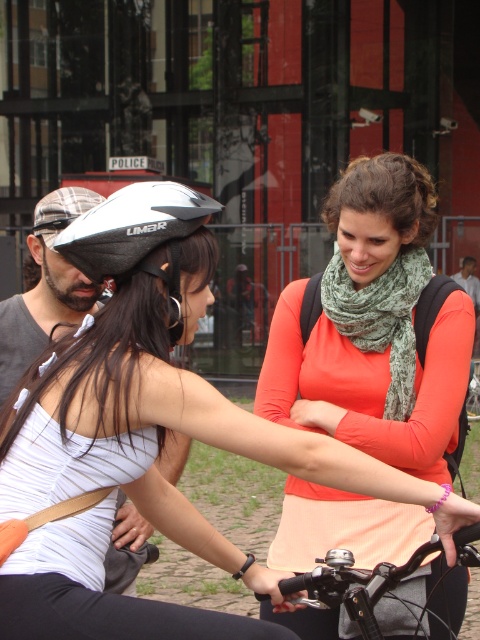
You are a photographer trying to capture a candid shot of the two women interacting. You want to ensure that both the dark gray fabric shirt at center and the metallic silver bicycle at center are visible in your frame. Based on their positions, which object should you position closer to the left side of your camera viewfinder to include both subjects effectively?

Since the dark gray fabric shirt at center is to the right of the metallic silver bicycle at center, you should position the metallic silver bicycle at center closer to the left side of your camera viewfinder. This way, the dark gray fabric shirt at center will naturally fall to the right, keeping both within the frame without overcrowding.